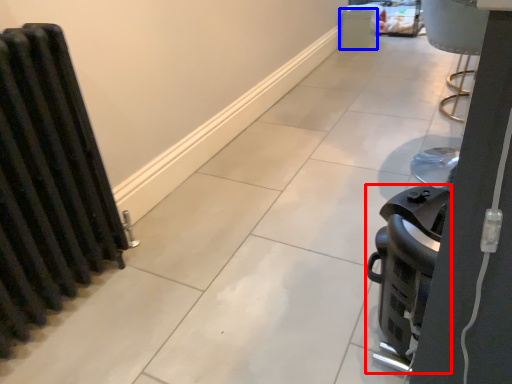
Question: Which object is closer to the camera taking this photo, appliance (highlighted by a red box) or appliance (highlighted by a blue box)?

Choices:
 (A) appliance
 (B) appliance

Answer: (A)